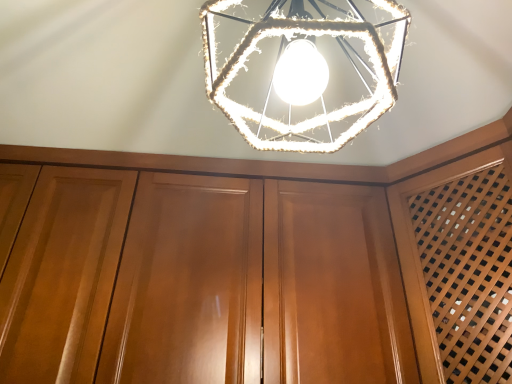
Question: Is glossy wood dresser at center in front of or behind rope-wrapped hexagonal light at center in the image?

Choices:
 (A) front
 (B) behind

Answer: (B)

Question: From a real-world perspective, is glossy wood dresser at center above or below rope-wrapped hexagonal light at center?

Choices:
 (A) above
 (B) below

Answer: (B)

Question: From the image's perspective, relative to rope-wrapped hexagonal light at center, is glossy wood dresser at center above or below?

Choices:
 (A) below
 (B) above

Answer: (A)

Question: Considering the positions of rope-wrapped hexagonal light at center and glossy wood dresser at center in the image, is rope-wrapped hexagonal light at center wider or thinner than glossy wood dresser at center?

Choices:
 (A) wide
 (B) thin

Answer: (B)

Question: Considering the positions of point [x=318, y=77] and point [x=436, y=236], is point [x=318, y=77] closer or farther from the camera than point [x=436, y=236]?

Choices:
 (A) closer
 (B) farther

Answer: (A)

Question: Is rope-wrapped hexagonal light at center inside or outside of glossy wood dresser at center?

Choices:
 (A) inside
 (B) outside

Answer: (B)

Question: Is rope-wrapped hexagonal light at center taller or shorter than glossy wood dresser at center?

Choices:
 (A) short
 (B) tall

Answer: (A)